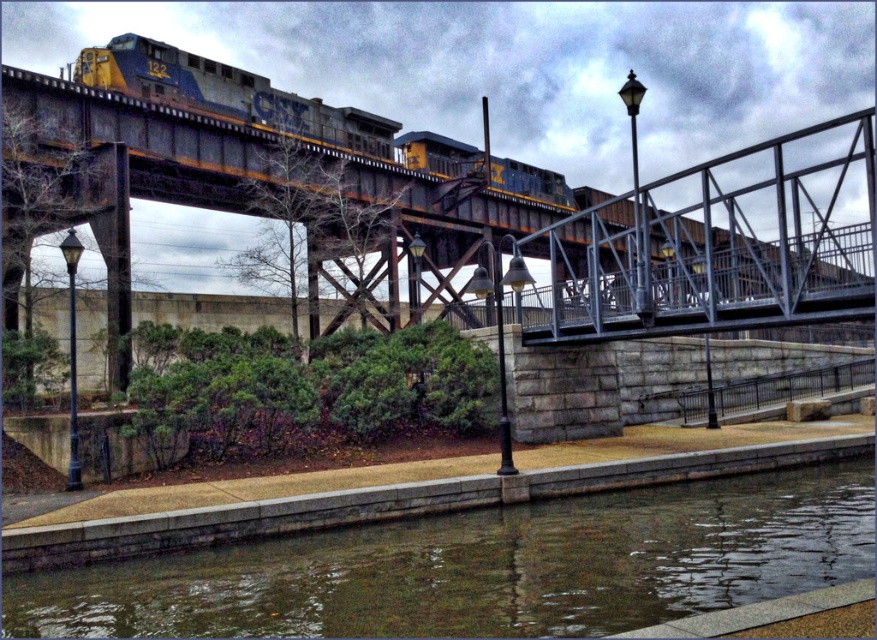
Is smooth concrete river at lower center shorter than rusty metal train at upper center?

Correct, smooth concrete river at lower center is not as tall as rusty metal train at upper center.

Who is more forward, (578, 515) or (404, 152)?

Point (578, 515) is in front.

Locate an element on the screen. Image resolution: width=877 pixels, height=640 pixels. smooth concrete river at lower center is located at coordinates (485, 566).

Does point (9, 298) lie behind point (532, 577)?

Yes, it is behind point (532, 577).

Between rusty metal bridge at upper center and smooth concrete river at lower center, which one is positioned lower?

smooth concrete river at lower center

Which is in front, point (461, 301) or point (411, 592)?

Positioned in front is point (411, 592).

Locate an element on the screen. This screenshot has width=877, height=640. rusty metal bridge at upper center is located at coordinates click(x=498, y=221).

Which is behind, point (91, 140) or point (272, 116)?

Positioned behind is point (272, 116).

Does rusty metal bridge at upper center have a greater height compared to rusty metal train at upper center?

Yes, rusty metal bridge at upper center is taller than rusty metal train at upper center.

Is point (68, 102) closer to camera compared to point (191, 61)?

That is True.

Locate an element on the screen. Image resolution: width=877 pixels, height=640 pixels. rusty metal bridge at upper center is located at coordinates (498, 221).